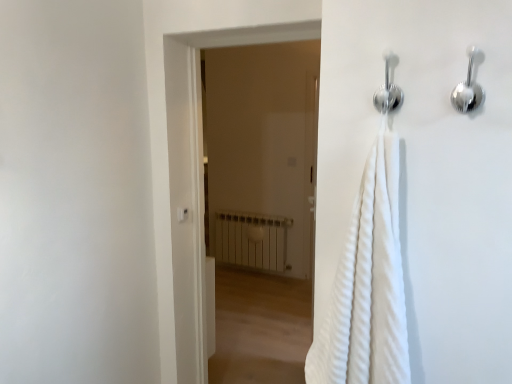
Locate an element on the screen. The width and height of the screenshot is (512, 384). vacant area situated below white matte radiator at center (from a real-world perspective) is located at coordinates (252, 272).